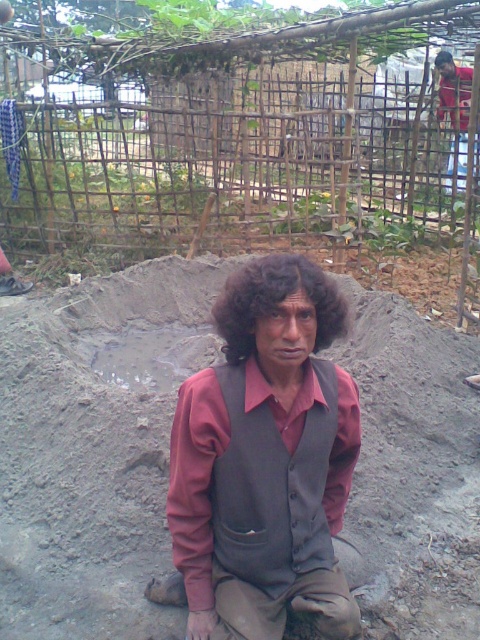
Question: Which of these objects is positioned closest to the brown fabric shirt at upper right?

Choices:
 (A) gray clay pit at center
 (B) dark gray fabric vest at center
 (C) dark curly hair at center

Answer: (A)

Question: Which is farther from the dark curly hair at center?

Choices:
 (A) gray clay pit at center
 (B) brown fabric shirt at upper right

Answer: (B)

Question: Among these objects, which one is farthest from the camera?

Choices:
 (A) dark gray fabric vest at center
 (B) brown fabric shirt at upper right
 (C) gray clay pit at center

Answer: (B)

Question: In this image, where is gray clay pit at center located relative to dark gray fabric vest at center?

Choices:
 (A) below
 (B) above

Answer: (B)

Question: Can you confirm if gray clay pit at center is positioned below brown fabric shirt at upper right?

Choices:
 (A) yes
 (B) no

Answer: (A)

Question: Can you confirm if gray clay pit at center is bigger than dark curly hair at center?

Choices:
 (A) yes
 (B) no

Answer: (A)